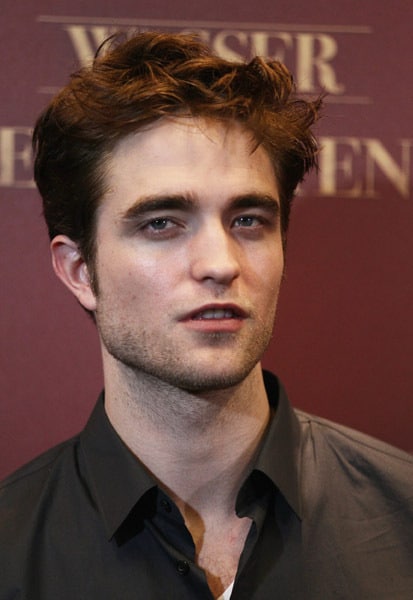
Where is `golden text on wall`? golden text on wall is located at coordinates tap(329, 167), tap(10, 145), tap(83, 48), tap(221, 49), tap(262, 48), tap(305, 63), tap(376, 151).